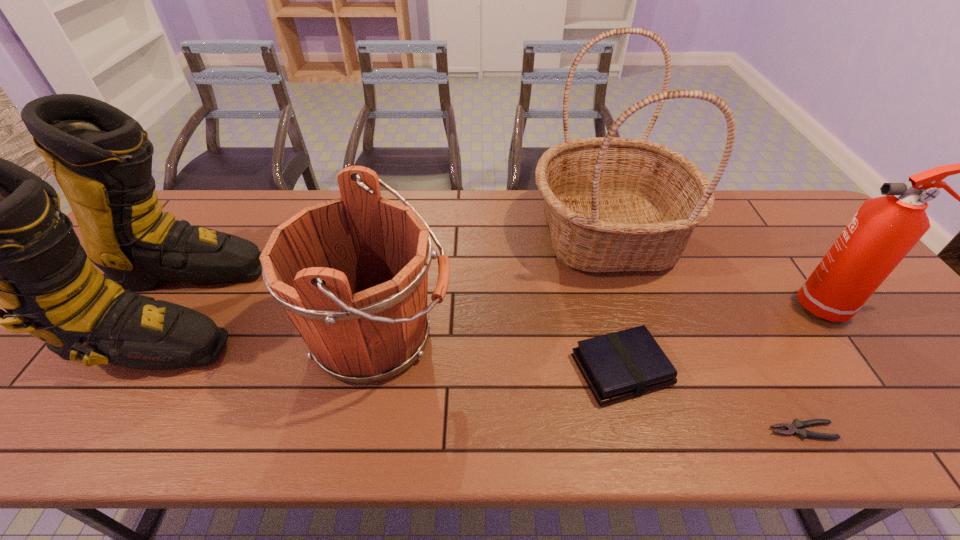
Identify the location of vacant space located 0.310m at the nozzle of the fire extinguisher. This screenshot has height=540, width=960. (677, 307).

You are a GUI agent. You are given a task and a screenshot of the screen. Output one action in this format:
    pyautogui.click(x=<x>, y=<y>)
    Task: Click on the free space located at the nozzle of the fire extinguisher
    
    Given the screenshot: What is the action you would take?
    pyautogui.click(x=754, y=307)

I want to click on vacant space located with the handle on the side of the fifth object from right to left, so click(553, 338).

Locate an element on the screen. This screenshot has height=540, width=960. vacant space situated 0.190m on the back of the book is located at coordinates (598, 280).

What are the coordinates of `vacant space located at the gripping part of the pliers` in the screenshot? It's located at (609, 431).

Identify the location of free spot located 0.060m at the gripping part of the pliers. (740, 431).

You are a GUI agent. You are given a task and a screenshot of the screen. Output one action in this format:
    pyautogui.click(x=<x>, y=<y>)
    Task: Click on the vacant space located at the gripping part of the pliers
    The image size is (960, 540).
    Given the screenshot: What is the action you would take?
    pyautogui.click(x=726, y=431)

The height and width of the screenshot is (540, 960). I want to click on object situated at the far edge, so click(x=612, y=204).

Where is `bucket at the near edge`? The height and width of the screenshot is (540, 960). bucket at the near edge is located at coordinates (351, 273).

Locate an element on the screen. book situated at the near edge is located at coordinates (616, 366).